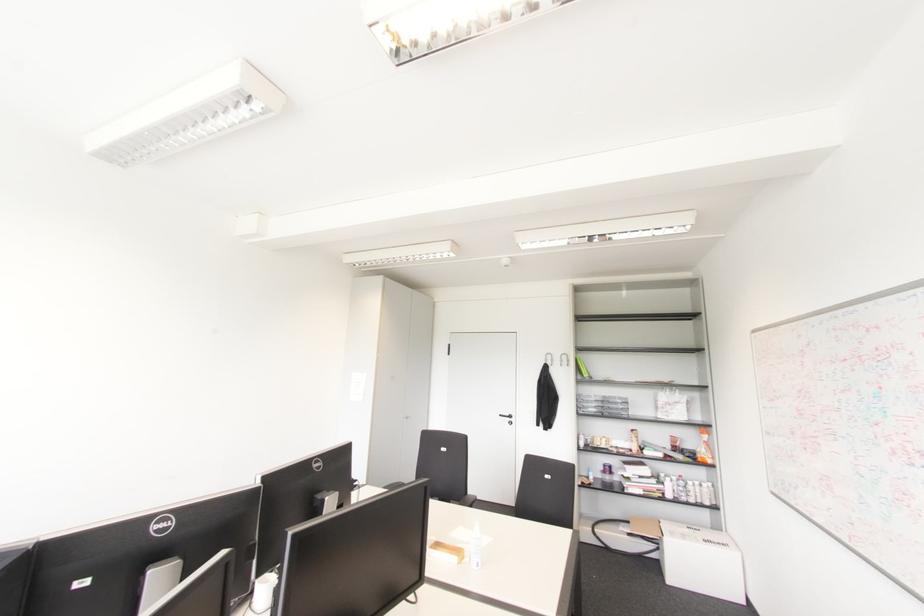
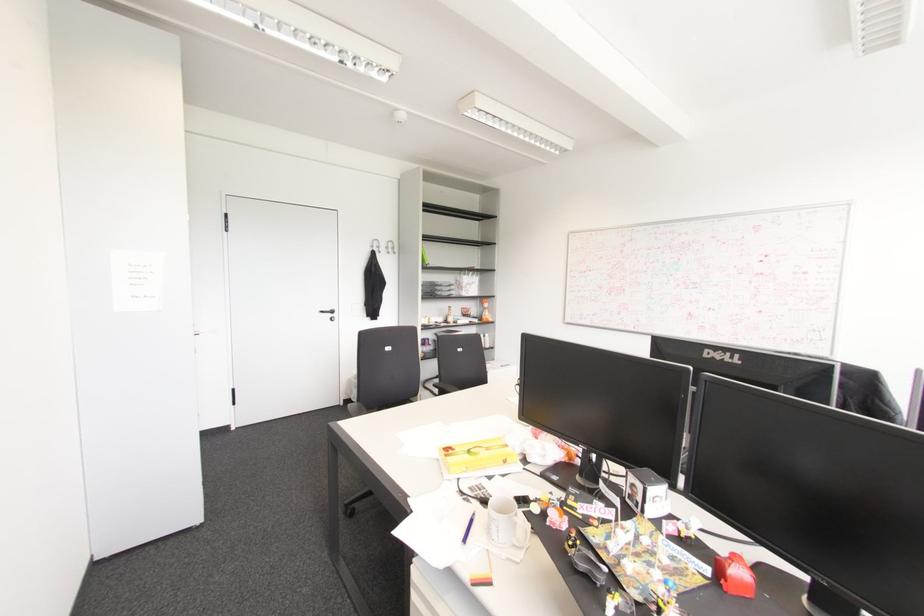
Locate, in the second image, the point that corresponds to point (704, 437) in the first image.

(485, 305)